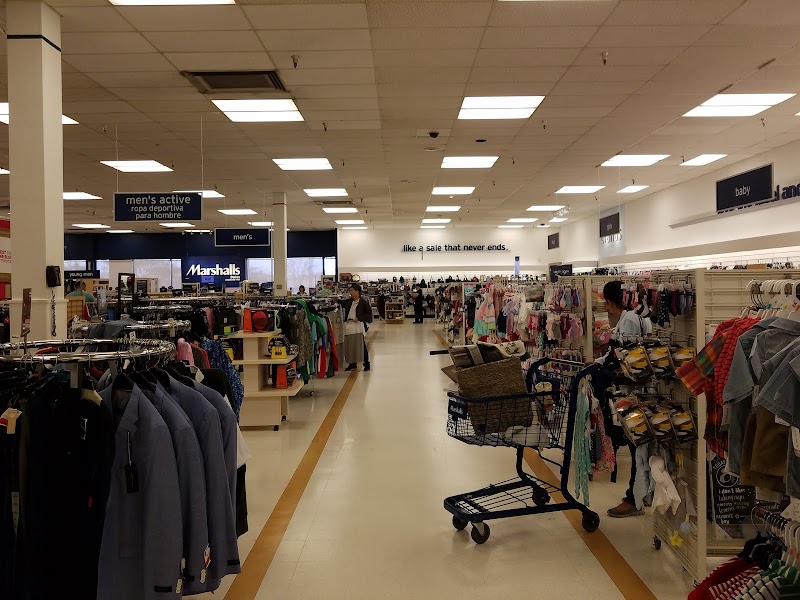
This screenshot has height=600, width=800. I want to click on ceiling, so click(590, 58).